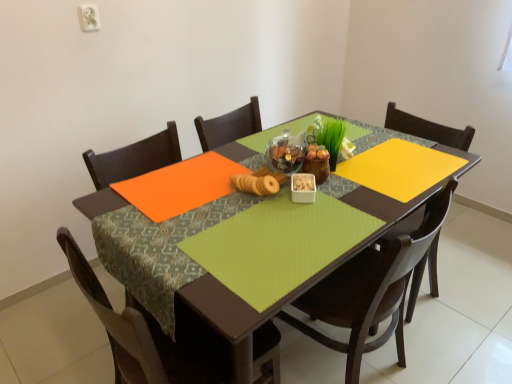
At what (x,y) coordinates should I click in order to perform the action: click on free spot above green fabric table at center (from a real-world perspective). Please return your answer as a coordinate pair (x, y). Looking at the image, I should click on (284, 191).